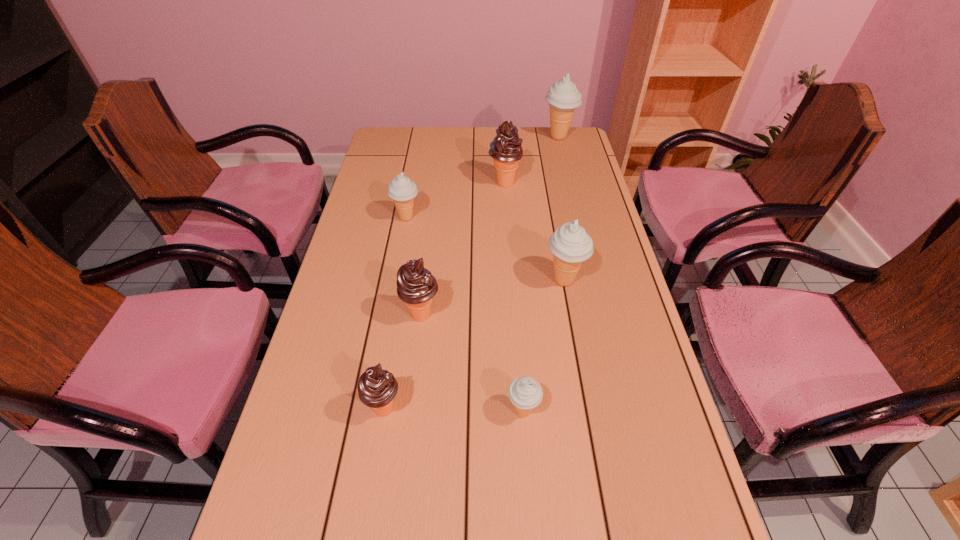
The height and width of the screenshot is (540, 960). Identify the location of unoccupied position between the sixth nearest icecream and the fifth nearest object. (456, 201).

Locate an element on the screen. The height and width of the screenshot is (540, 960). free space that is in between the biggest chocolate icecream and the farthest beige icecream is located at coordinates (532, 160).

The width and height of the screenshot is (960, 540). In order to click on object that is the second closest to the biggest chocolate icecream in this screenshot , I will do click(401, 189).

Find the location of a particular element. object that is the third closest to the fourth farthest icecream is located at coordinates (506, 150).

Find the location of `icecream that is the sixth closest to the farthest beige icecream`. icecream that is the sixth closest to the farthest beige icecream is located at coordinates tap(377, 388).

Locate an element on the screen. Image resolution: width=960 pixels, height=540 pixels. icecream that is the closest one to the smallest chocolate icecream is located at coordinates (416, 286).

Identify the location of beige icecream that stands as the third closest to the leftmost beige icecream. (525, 393).

Find the location of a particular element. This screenshot has height=540, width=960. beige icecream object that ranks as the fourth closest to the second biggest chocolate icecream is located at coordinates (563, 97).

Locate an element on the screen. This screenshot has height=540, width=960. chocolate icecream that is the nearest to the nearest beige icecream is located at coordinates (377, 388).

Select which chocolate icecream is the second closest to the farthest object. Please provide its 2D coordinates. Your answer should be formatted as a tuple, i.e. [(x, y)], where the tuple contains the x and y coordinates of a point satisfying the conditions above.

[(416, 286)]